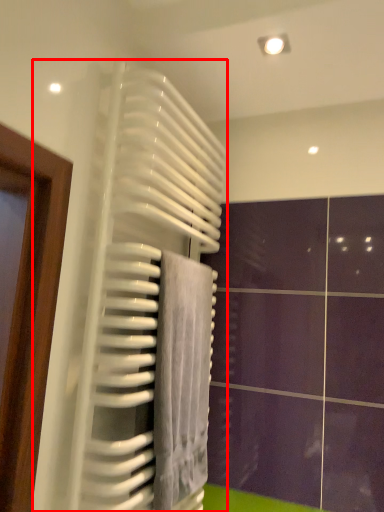
Question: From the image's perspective, where is radiator (annotated by the red box) located relative to towel?

Choices:
 (A) above
 (B) below

Answer: (A)